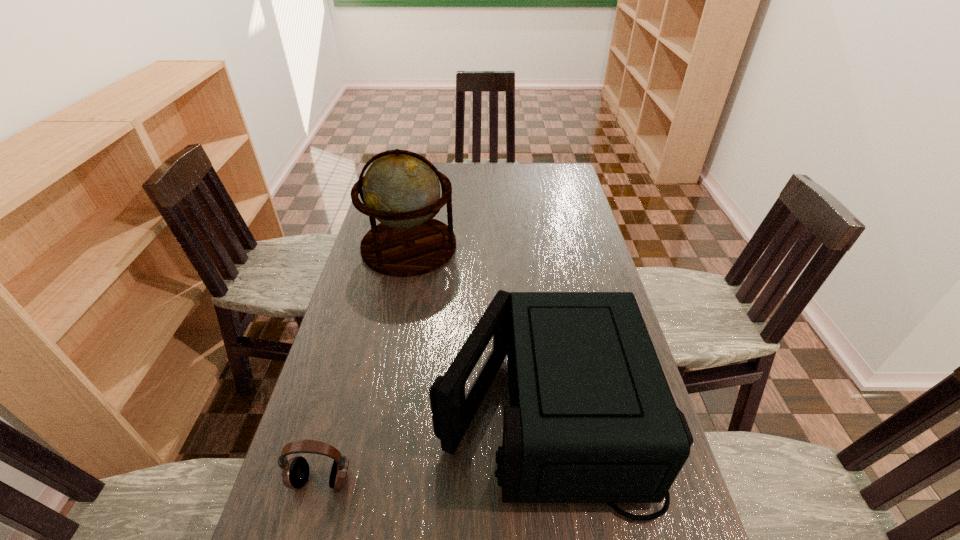
Find the location of a particular element. The width and height of the screenshot is (960, 540). headset located in the left edge section of the desktop is located at coordinates (295, 472).

The image size is (960, 540). I want to click on object located in the right edge section of the desktop, so click(592, 419).

In order to click on blank space at the far edge of the desktop in this screenshot , I will do `click(530, 177)`.

In the image, there is a desktop. Where is `vacant space at the left edge`? vacant space at the left edge is located at coordinates (338, 414).

This screenshot has width=960, height=540. In order to click on free spot between the headset and the globe in this screenshot , I will do `click(365, 363)`.

Locate an element on the screen. The image size is (960, 540). blank region between the headset and the second shortest object is located at coordinates (433, 444).

Locate an element on the screen. Image resolution: width=960 pixels, height=540 pixels. blank region between the headset and the second tallest object is located at coordinates (433, 444).

I want to click on object that ranks as the second closest to the tallest object, so click(x=295, y=472).

Identify which object is located as the nearest to the headset. Please provide its 2D coordinates. Your answer should be formatted as a tuple, i.e. [(x, y)], where the tuple contains the x and y coordinates of a point satisfying the conditions above.

[(592, 419)]

Where is `vacant space that satisfies the following two spatial constraints: 1. with the door open on the second shortest object; 2. on the ear pads of the shortest object`? The width and height of the screenshot is (960, 540). vacant space that satisfies the following two spatial constraints: 1. with the door open on the second shortest object; 2. on the ear pads of the shortest object is located at coordinates (554, 480).